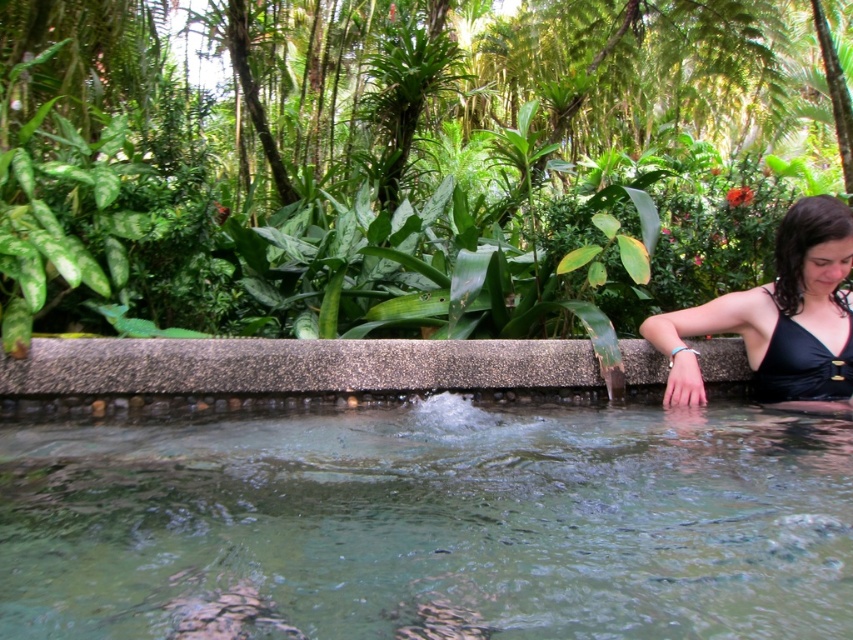
You are a photographer at the edge of the natural pool. You need to capture both the black matte swimsuit at right and the black matte bikini top at right in a single frame. Which object should you focus on first to ensure both are clearly visible?

The black matte swimsuit at right is larger in size than the black matte bikini top at right, so focusing on the swimsuit first will help ensure both objects are in clear view.

Consider the image. You are a photographer trying to capture the perfect shot of the black matte swimsuit at right and the black matte bikini top at right. From your current position, which one is positioned more to the left side?

The black matte swimsuit at right is positioned to the left of the black matte bikini top at right, so the swimsuit is more to the left.